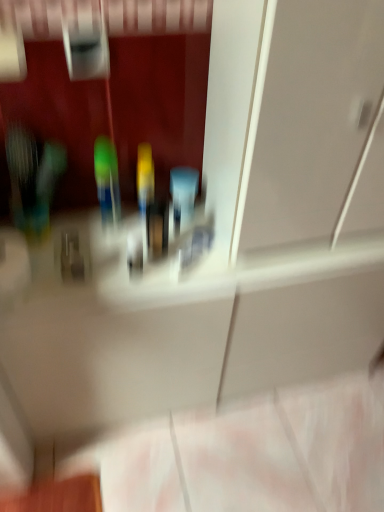
Where is `free space to the left of green plastic toothbrush at center`? free space to the left of green plastic toothbrush at center is located at coordinates (69, 229).